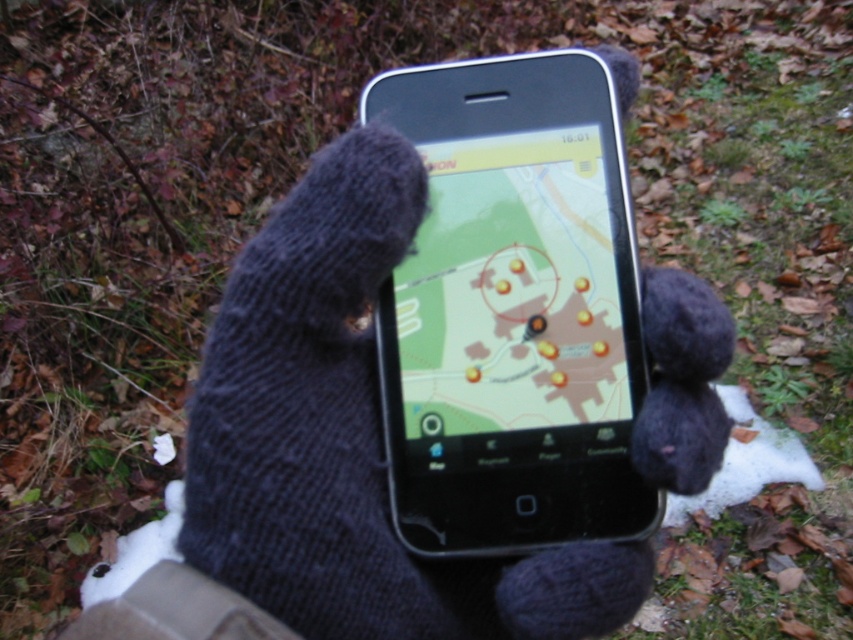
The height and width of the screenshot is (640, 853). What do you see at coordinates (512, 310) in the screenshot?
I see `black glossy smartphone at center` at bounding box center [512, 310].

Between black glossy smartphone at center and dark blue knitted glove at center, which one has more height?

Standing taller between the two is black glossy smartphone at center.

Identify the location of black glossy smartphone at center. The width and height of the screenshot is (853, 640). (512, 310).